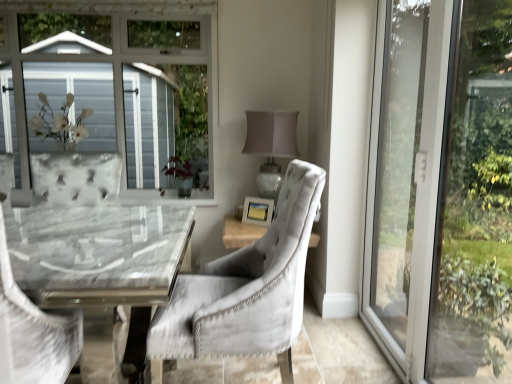
Question: Choose the correct answer: Is green matte plant at center inside matte wooden picture frame at center or outside it?

Choices:
 (A) outside
 (B) inside

Answer: (A)

Question: Is green matte plant at center bigger or smaller than matte wooden picture frame at center?

Choices:
 (A) big
 (B) small

Answer: (A)

Question: Which object is the farthest from the green matte plant at center?

Choices:
 (A) velvet gray chair at left, marked as the 2th chair in a right-to-left arrangement
 (B) matte gray lampshade at upper right
 (C) matte wooden picture frame at center
 (D) velvet grey chair at center, arranged as the 1th chair when viewed from the right
 (E) transparent glass door at right

Answer: (A)

Question: Considering the real-world distances, which object is farthest from the velvet gray chair at left, which appears as the first chair when viewed from the left?

Choices:
 (A) matte gray lampshade at upper right
 (B) green matte plant at center
 (C) velvet grey chair at center, arranged as the 1th chair when viewed from the right
 (D) matte wooden picture frame at center
 (E) transparent glass door at right

Answer: (B)